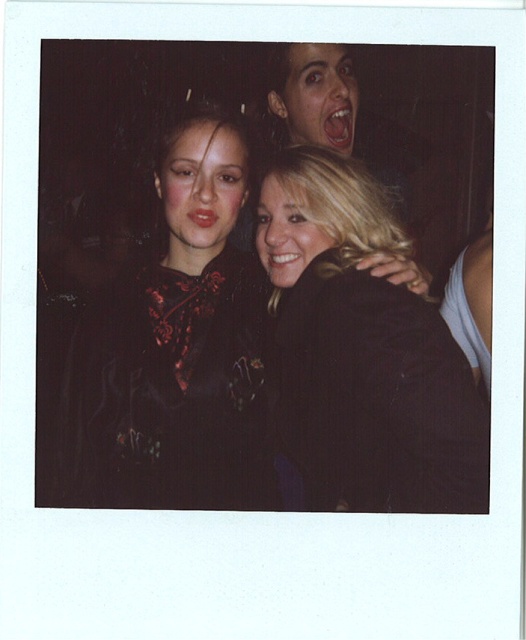
Can you confirm if matte black blouse at center is smaller than blonde hair at center?

Yes.

Between matte black blouse at center and blonde hair at center, which one has less height?

Standing shorter between the two is blonde hair at center.

Identify the location of matte black blouse at center. click(177, 348).

I want to click on matte black blouse at center, so click(x=177, y=348).

Which is below, black textured jacket at center or matte black blouse at center?

matte black blouse at center

The image size is (526, 640). Describe the element at coordinates (259, 300) in the screenshot. I see `black textured jacket at center` at that location.

Locate an element on the screen. This screenshot has height=640, width=526. black textured jacket at center is located at coordinates (259, 300).

This screenshot has width=526, height=640. What do you see at coordinates (259, 300) in the screenshot? I see `black textured jacket at center` at bounding box center [259, 300].

Is point (168, 438) closer to viewer compared to point (482, 456)?

That is False.

Image resolution: width=526 pixels, height=640 pixels. Identify the location of black textured jacket at center. (259, 300).